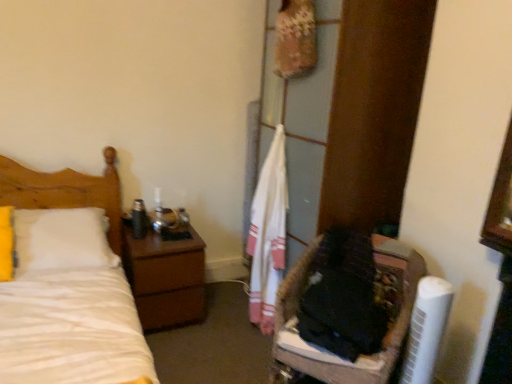
Find the location of a particular element. The image size is (512, 384). free space between brown wood nightstand at left and white cotton towel at center is located at coordinates (218, 321).